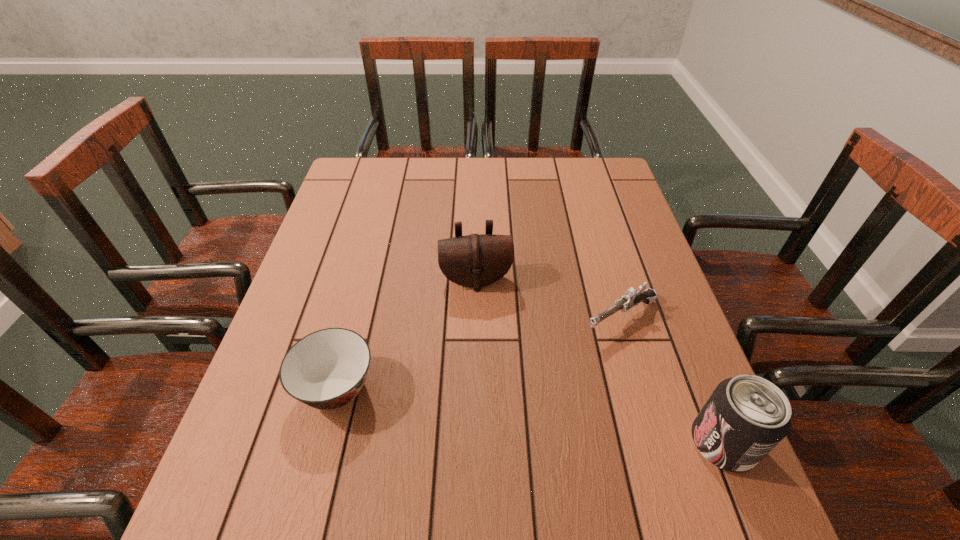
In the image, there is a desktop. At what (x,y) coordinates should I click in order to perform the action: click on vacant space at the far edge. Please return your answer as a coordinate pair (x, y). This screenshot has width=960, height=540. Looking at the image, I should click on (551, 197).

Find the location of a particular element. This screenshot has width=960, height=540. free space at the near edge is located at coordinates (422, 469).

This screenshot has width=960, height=540. In order to click on vacant point at the left edge in this screenshot , I will do `click(322, 324)`.

At what (x,y) coordinates should I click in order to perform the action: click on vacant area at the right edge. Please return your answer as a coordinate pair (x, y). Looking at the image, I should click on (648, 323).

Where is `vacant space at the near left corner`? vacant space at the near left corner is located at coordinates (233, 463).

The image size is (960, 540). I want to click on vacant space at the far right corner of the desktop, so click(x=598, y=179).

In the image, there is a desktop. Where is `vacant space at the near right corner`? vacant space at the near right corner is located at coordinates (663, 441).

You are a GUI agent. You are given a task and a screenshot of the screen. Output one action in this format:
    pyautogui.click(x=<x>, y=<y>)
    Task: Click on the vacant space in between the gun and the soda can
    Image resolution: width=960 pixels, height=540 pixels.
    Given the screenshot: What is the action you would take?
    pyautogui.click(x=672, y=381)

Identify the location of vacant space in between the third nearest object and the second object from left to right. The width and height of the screenshot is (960, 540). (548, 299).

This screenshot has height=540, width=960. Find the location of `free space between the soda can and the third nearest object`. free space between the soda can and the third nearest object is located at coordinates (672, 381).